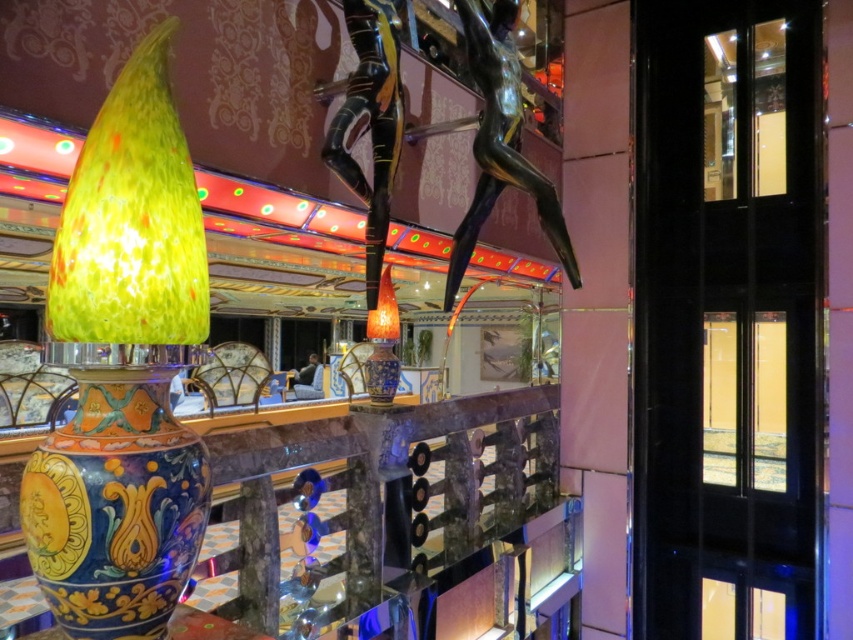
You are an interior designer who needs to place a new shelf that must be at least 3 feet tall. You see the multicolored ceramic vase at left and the shiny blue glass vase at center. Which vase is tall enough to determine if the shelf height requirement is met?

The multicolored ceramic vase at left is much taller than the shiny blue glass vase at center, so it can be used to determine if the shelf height requirement of 3 feet is met.

You are an interior designer arranging flowers. You need to place a tall bouquet in the multicolored ceramic vase at left and a shorter bouquet in the shiny blue glass vase at center. Which bouquet will be placed higher in the room?

The multicolored ceramic vase at left is above the shiny blue glass vase at center, so the tall bouquet placed in the multicolored ceramic vase at left will be higher in the room.

You are standing in the center of the room and see two points marked in the image. Which point is closer to you, point (99, 442) or point (367, 252)?

Point (99, 442) is in front of point (367, 252), so it is closer to you.